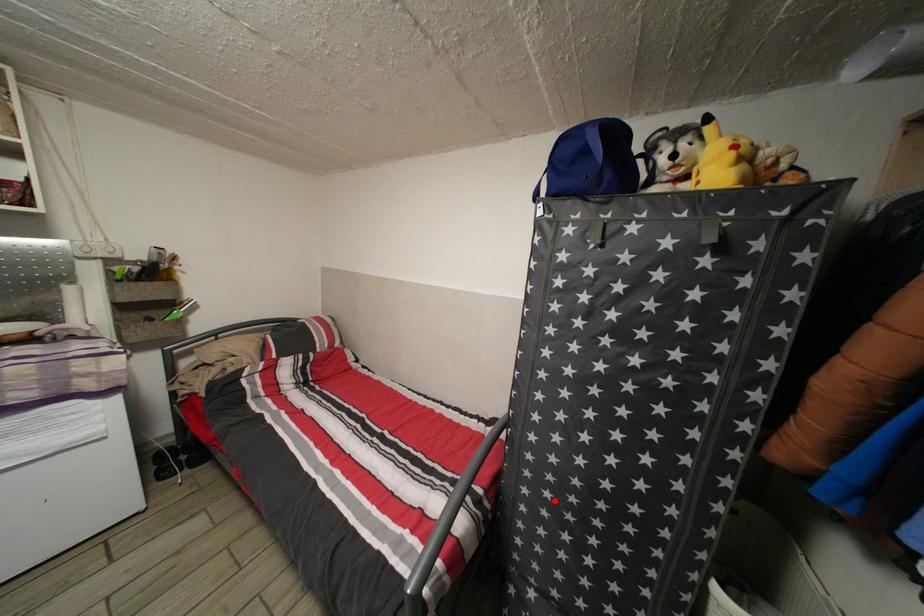
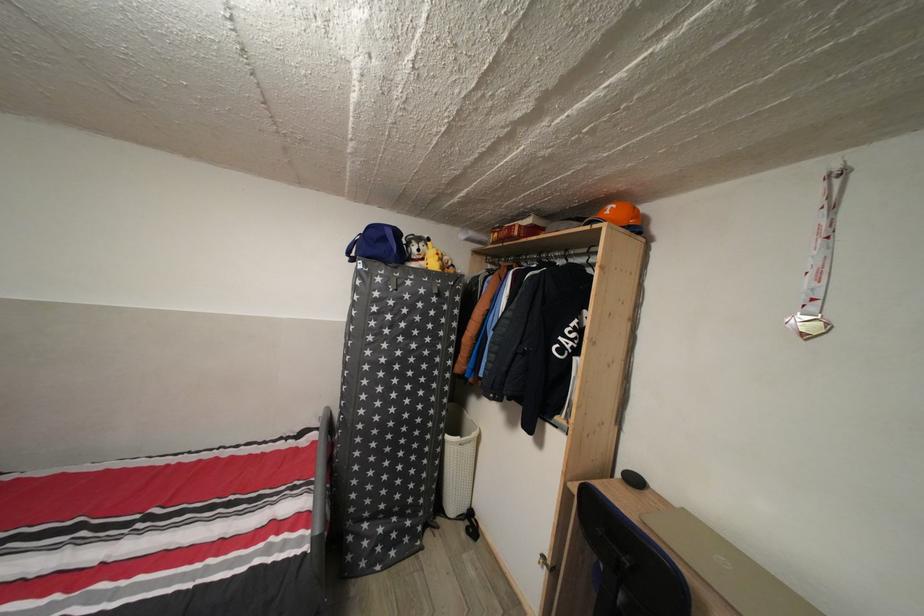
Locate, in the second image, the point that corresponds to the highlighted location in the first image.

(380, 451)